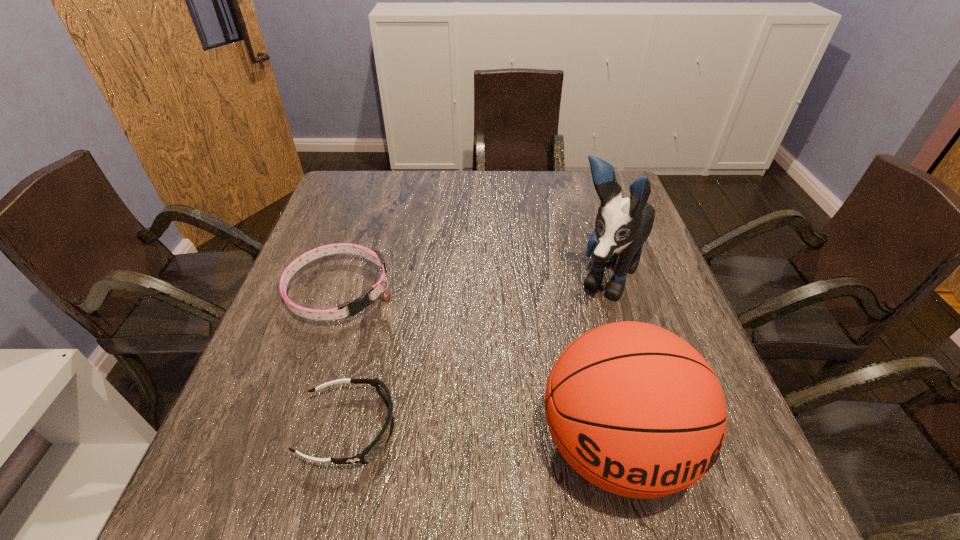
Find the location of a particular element. This screenshot has height=540, width=960. free point at the near edge is located at coordinates (367, 444).

Where is `free space at the left edge`? Image resolution: width=960 pixels, height=540 pixels. free space at the left edge is located at coordinates (316, 298).

Find the location of a particular element. free space at the right edge of the desktop is located at coordinates (649, 294).

Locate an element on the screen. This screenshot has height=540, width=960. vacant space at the far left corner is located at coordinates (361, 180).

The height and width of the screenshot is (540, 960). Find the location of `free space at the near left corner of the desktop`. free space at the near left corner of the desktop is located at coordinates (265, 449).

Find the location of a particular element. The height and width of the screenshot is (540, 960). vacant space in between the second tallest object and the shortest object is located at coordinates (482, 437).

The width and height of the screenshot is (960, 540). In order to click on vacant area between the dog collar and the third shortest object in this screenshot , I will do `click(477, 369)`.

I want to click on empty location between the dog collar and the third shortest object, so coord(477,369).

Locate an element on the screen. The width and height of the screenshot is (960, 540). free spot between the shortest object and the puppy is located at coordinates (477, 354).

At what (x,y) coordinates should I click in order to perform the action: click on vacant space that is in between the tallest object and the dog collar. Please return your answer as a coordinate pair (x, y). The image size is (960, 540). Looking at the image, I should click on (472, 285).